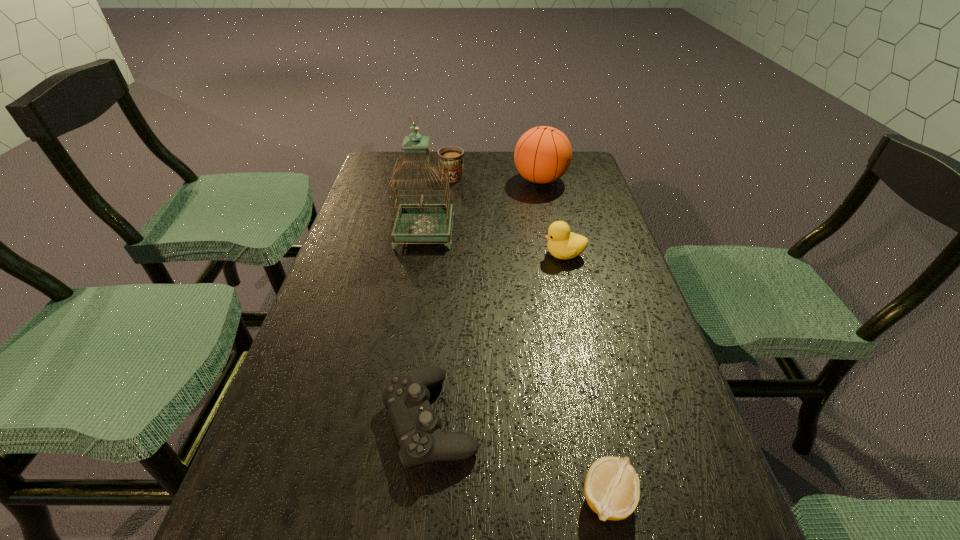
What are the coordinates of `blank area located 0.100m on the front-facing side of the duck` in the screenshot? It's located at (505, 254).

In order to click on blank area located on the side of the mug with the handle in this screenshot , I will do `click(454, 156)`.

Find the location of a particular element. The width and height of the screenshot is (960, 540). vacant space located 0.160m on the left of the second shortest object is located at coordinates (291, 420).

The height and width of the screenshot is (540, 960). What are the coordinates of `free region located 0.260m on the left of the shortest object` in the screenshot? It's located at (413, 499).

Find the location of a particular element. The image size is (960, 540). basketball at the far edge is located at coordinates (543, 154).

You are a GUI agent. You are given a task and a screenshot of the screen. Output one action in this format:
    pyautogui.click(x=<x>, y=<y>)
    Task: Click on the mug situated at the far edge
    The image size is (960, 540).
    Given the screenshot: What is the action you would take?
    pyautogui.click(x=454, y=156)

Identify the location of object positioned at the left edge. point(421,222).

Where is `basketball that is positioned at the right edge`? basketball that is positioned at the right edge is located at coordinates (543, 154).

Locate an element on the screen. This screenshot has height=540, width=960. duck positioned at the right edge is located at coordinates (563, 244).

Locate an element on the screen. lemon present at the right edge is located at coordinates (612, 489).